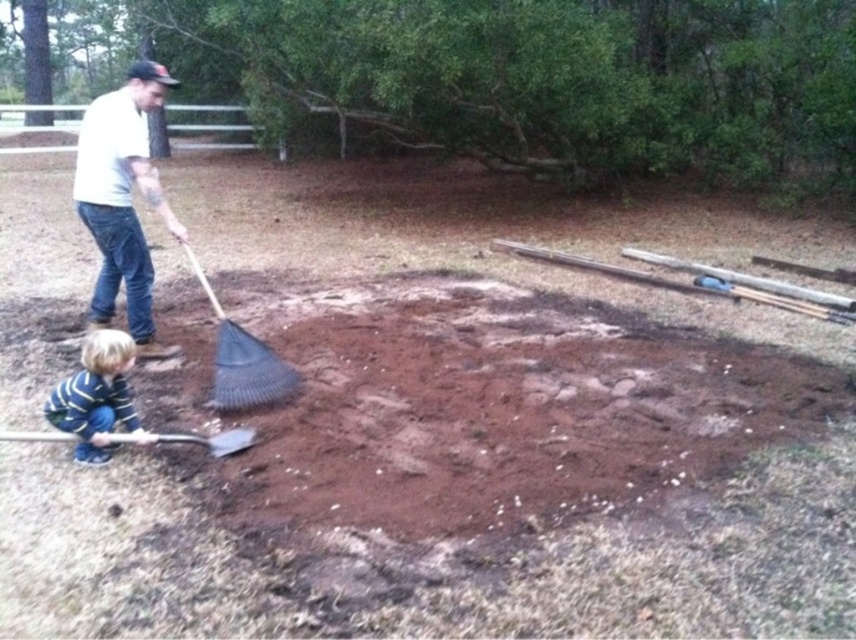
You are a gardener trying to locate your tools. You see the white matte shirt at upper left and the black plastic rake at center. Which tool is closer to you?

The white matte shirt at upper left is closer to you because the black plastic rake at center is behind it.

In the scene shown: You are a gardener who needs to move soil from the lower left to the center area. Which tool should you use, the black plastic rake at center or the wooden shovel at lower left?

The wooden shovel at lower left should be used to move soil from the lower left to the center area since it is positioned closer to that location compared to the black plastic rake at center, which is further away.

Where is the white matte shirt at upper left located in the image?

The white matte shirt at upper left is located at point (122,198).